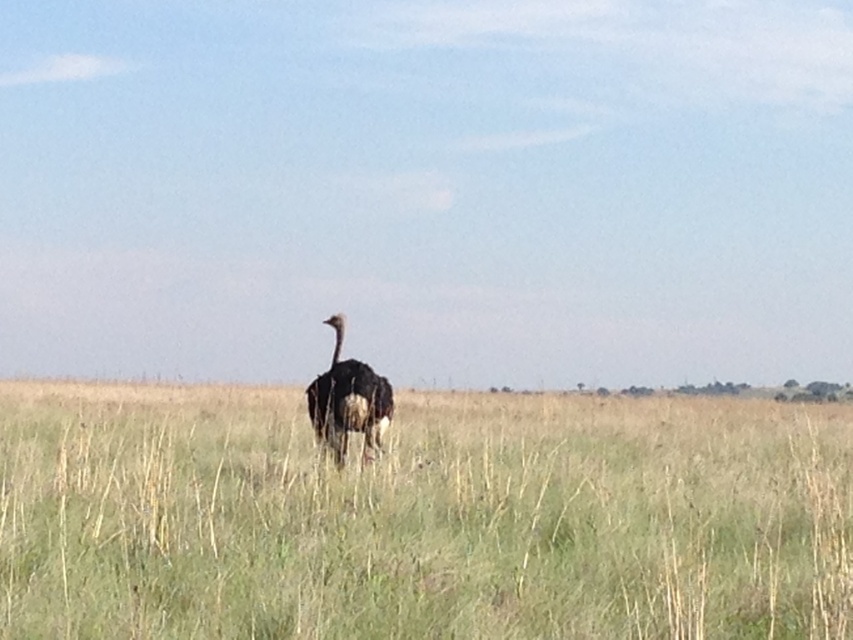
Question: Can you confirm if green grass at center is wider than dark brown feathers at center?

Choices:
 (A) no
 (B) yes

Answer: (B)

Question: Which point appears farthest from the camera in this image?

Choices:
 (A) (376, 376)
 (B) (0, 540)

Answer: (A)

Question: Is green grass at center wider than dark brown feathers at center?

Choices:
 (A) no
 (B) yes

Answer: (B)

Question: Is green grass at center positioned at the back of dark brown feathers at center?

Choices:
 (A) no
 (B) yes

Answer: (A)

Question: Which object appears farthest from the camera in this image?

Choices:
 (A) green grass at center
 (B) dark brown feathers at center

Answer: (B)